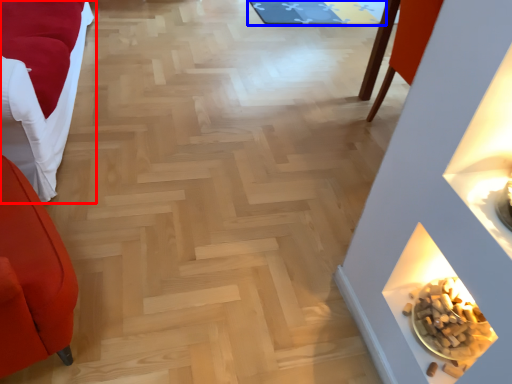
Question: Which object appears farthest to the camera in this image, furniture (highlighted by a red box) or mat (highlighted by a blue box)?

Choices:
 (A) furniture
 (B) mat

Answer: (B)